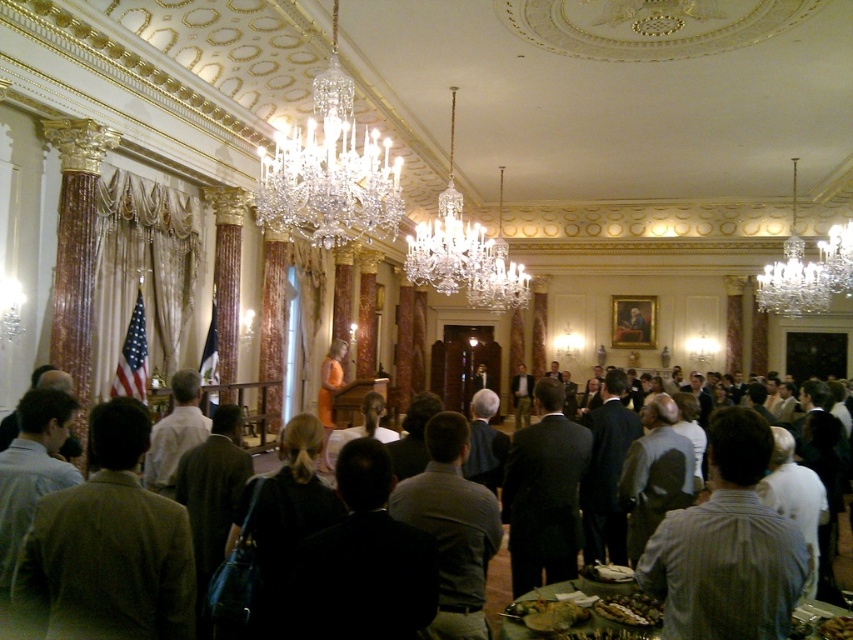
You are standing in the opulent room and want to move from the podium to the nearest exit located at point (x=657, y=625). There is an obstacle at point (x=840, y=570). Will you pass closer to the obstacle while moving towards the exit?

The obstacle at point (x=840, y=570) is further to the viewer than the exit at point (x=657, y=625). Therefore, when moving towards the exit, you will pass closer to the obstacle since it is nearer to your starting position at the podium.

You are a photographer at this event and need to capture a clear photo of both the dark brown suit at center and the shiny brown nuts at lower center. Since the camera can only focus on one subject at a time, which object should you focus on first to ensure the larger one is in focus?

The dark brown suit at center has a larger size compared to the shiny brown nuts at lower center, so you should focus on the dark brown suit at center first to ensure it is in focus.